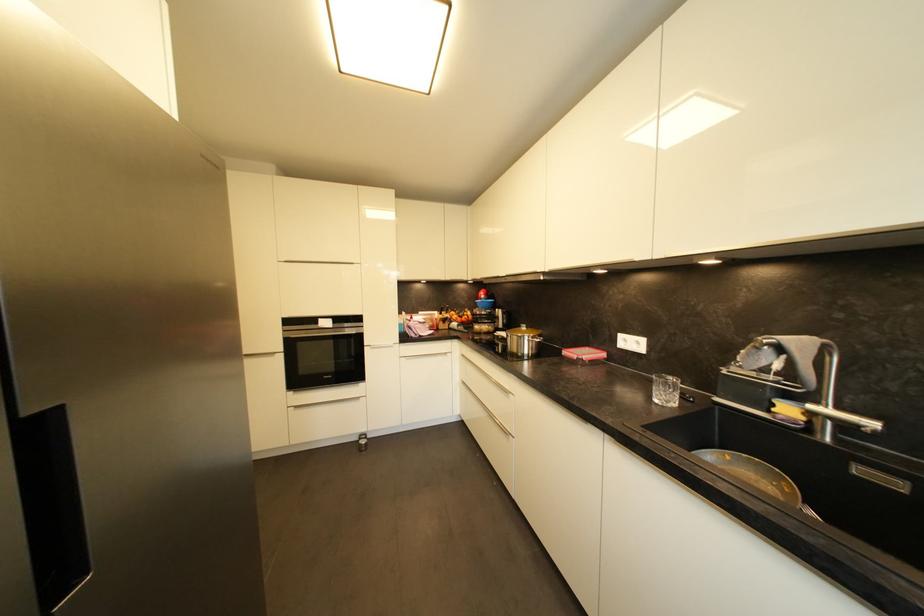
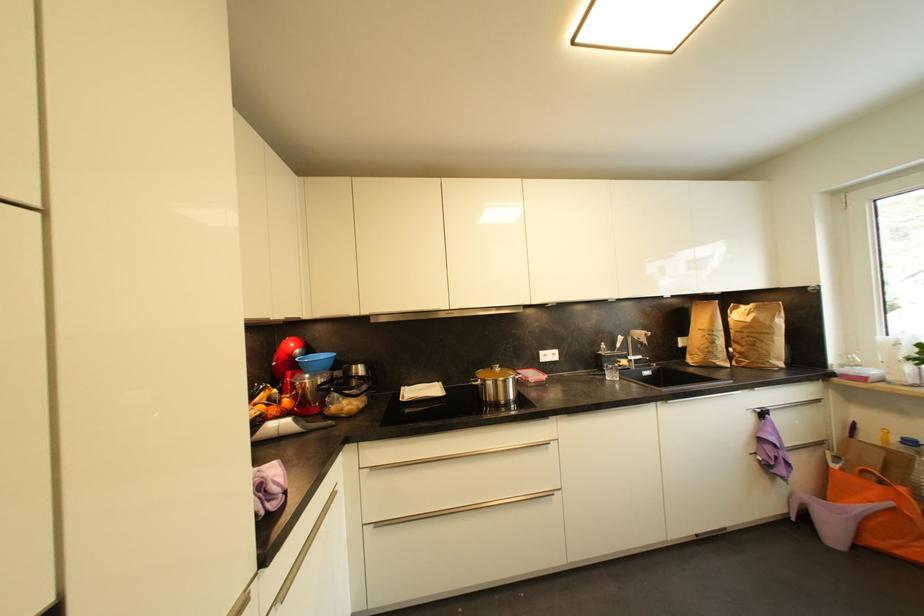
The point at [878,426] is marked in the first image. Where is the corresponding point in the second image?

(645, 359)